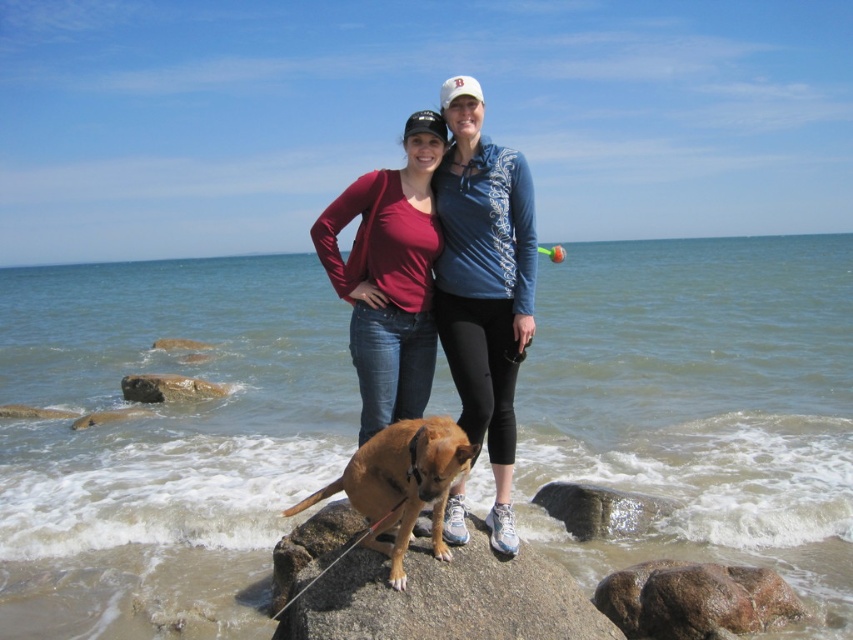
Question: Does clear blue water at center appear on the left side of smooth gray rock at lower left?

Choices:
 (A) yes
 (B) no

Answer: (B)

Question: Which point is closer to the camera?

Choices:
 (A) (173, 394)
 (B) (364, 612)
 (C) (625, 525)
 (D) (498, 172)

Answer: (B)

Question: Does clear blue water at center have a larger size compared to brown rough rock at lower right?

Choices:
 (A) no
 (B) yes

Answer: (B)

Question: Is brown smooth rock at center to the right of matte red shirt at center from the viewer's perspective?

Choices:
 (A) no
 (B) yes

Answer: (B)

Question: Which point is closer to the camera?

Choices:
 (A) (424, 198)
 (B) (408, 492)

Answer: (B)

Question: Among these objects, which one is farthest from the camera?

Choices:
 (A) smooth gray rock at lower left
 (B) brown smooth rock at center
 (C) clear blue water at center

Answer: (A)